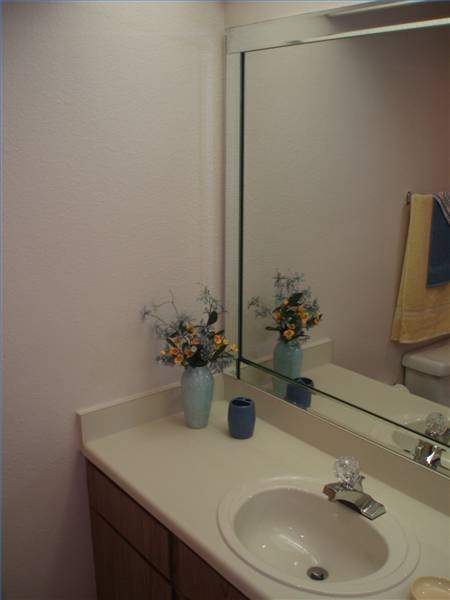
The image size is (450, 600). In order to click on drawer in this screenshot , I will do `click(144, 540)`.